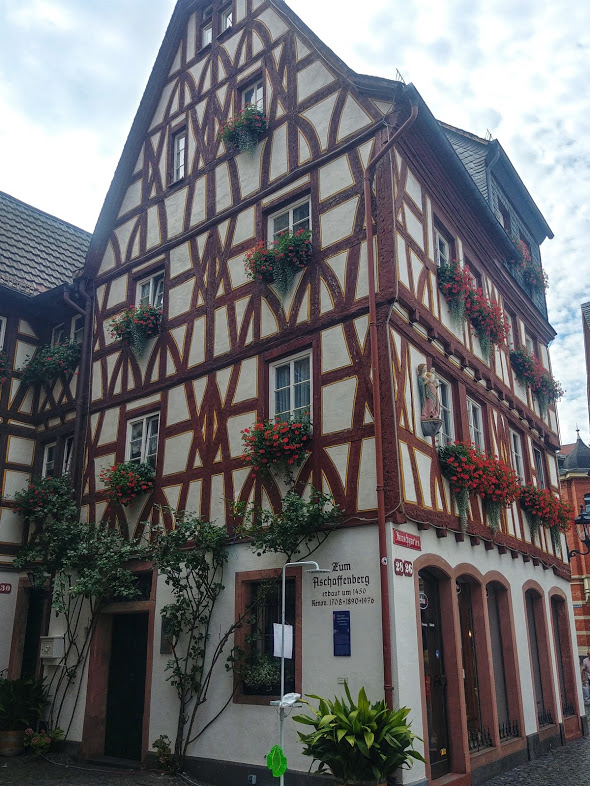
The height and width of the screenshot is (786, 590). I want to click on plant, so click(365, 722).